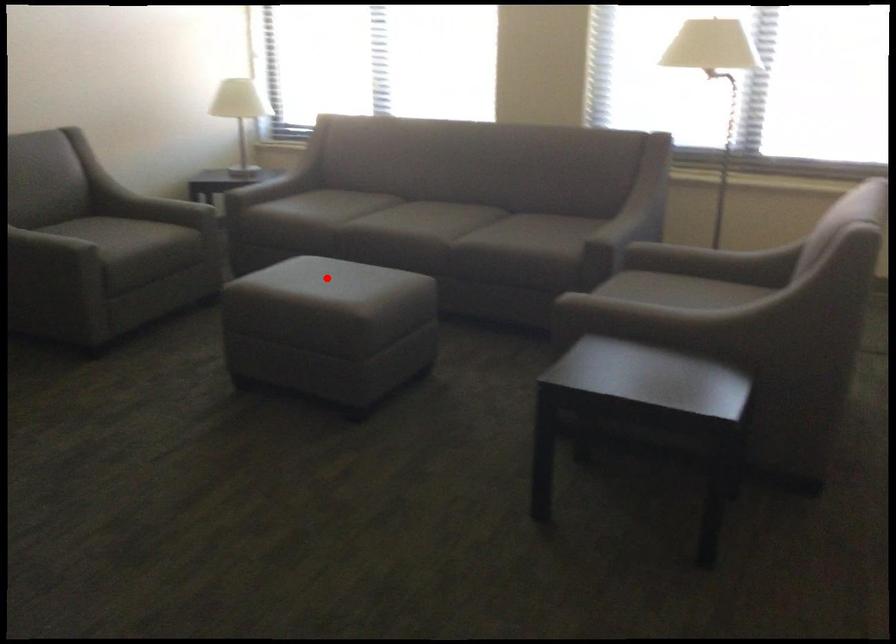
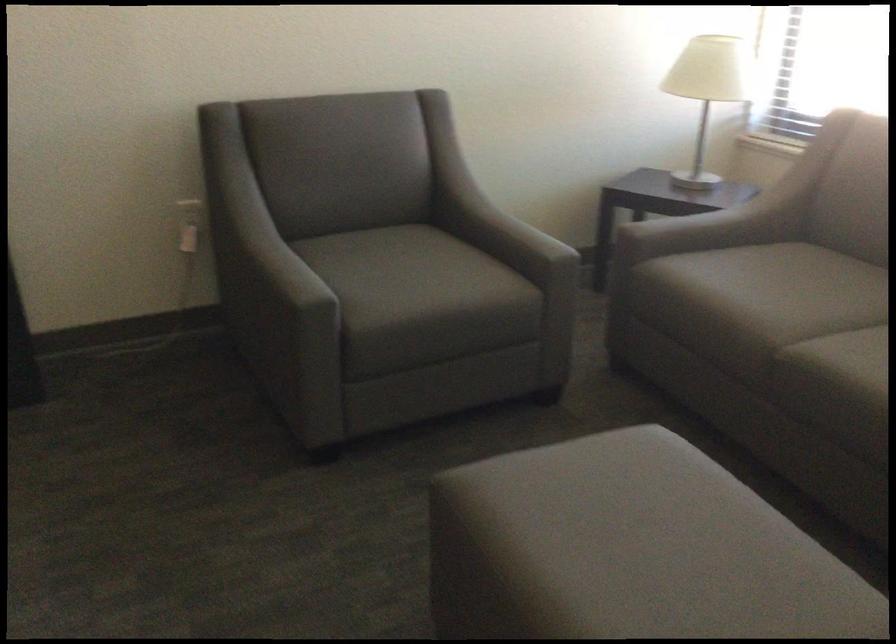
Question: A red point is marked in image1. In image2, is the corresponding 3D point closer to the camera or farther? Reply with the corresponding letter.

Choices:
 (A) The corresponding 3D point is closer.
 (B) The corresponding 3D point is farther.

Answer: (A)